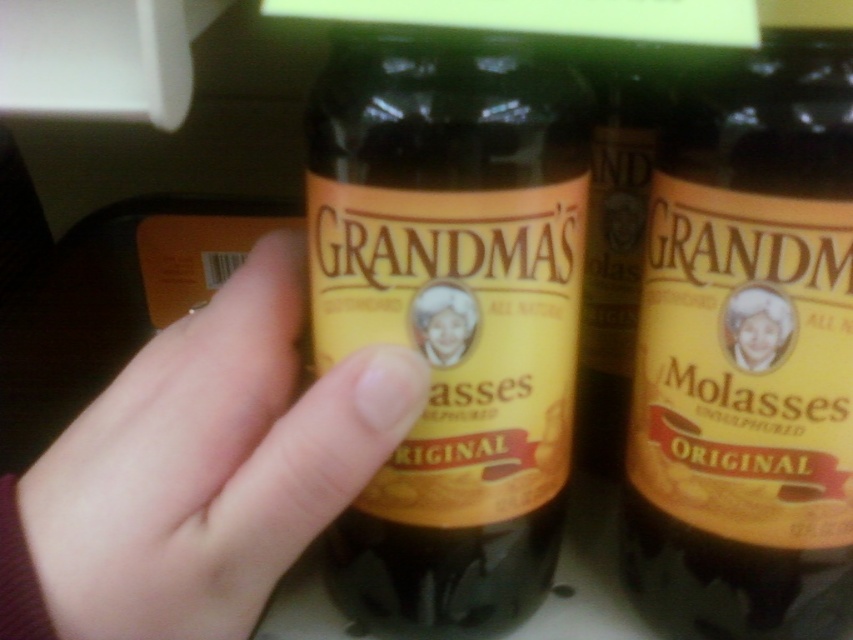
Question: Which point appears closest to the camera in this image?

Choices:
 (A) (761, 515)
 (B) (340, 204)
 (C) (779, 294)

Answer: (B)

Question: Is matte glass bottle at center below smooth skin at center?

Choices:
 (A) no
 (B) yes

Answer: (A)

Question: Which point is farther to the camera?

Choices:
 (A) (735, 349)
 (B) (518, 317)
 (C) (144, 490)

Answer: (A)

Question: Can you confirm if matte glass bottle at center is positioned below matte yellow label at center?

Choices:
 (A) yes
 (B) no

Answer: (A)

Question: Which object is the farthest from the matte glass jar at center?

Choices:
 (A) matte yellow label at center
 (B) smooth skin at center
 (C) matte glass bottle at center

Answer: (A)

Question: Considering the relative positions of matte glass bottle at center and smooth skin at center in the image provided, where is matte glass bottle at center located with respect to smooth skin at center?

Choices:
 (A) above
 (B) below

Answer: (A)